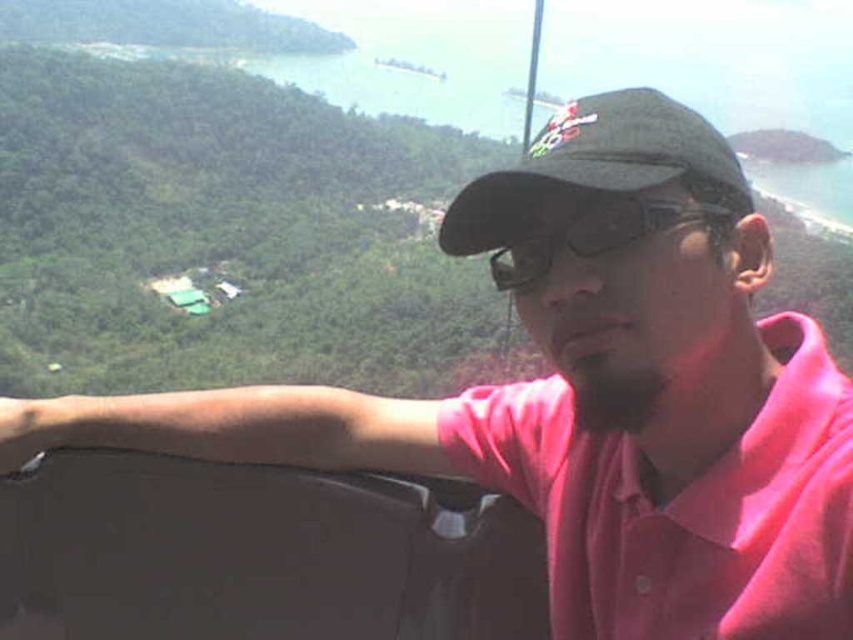
Is point (688, 589) farther from camera compared to point (645, 90)?

No, it is in front of (645, 90).

Can you confirm if pink cotton polo shirt at center is positioned above black fabric baseball cap at center?

Actually, pink cotton polo shirt at center is below black fabric baseball cap at center.

Is point (619, 454) positioned after point (643, 134)?

Yes, point (619, 454) is farther from viewer.

This screenshot has height=640, width=853. Find the location of `pink cotton polo shirt at center`. pink cotton polo shirt at center is located at coordinates (682, 506).